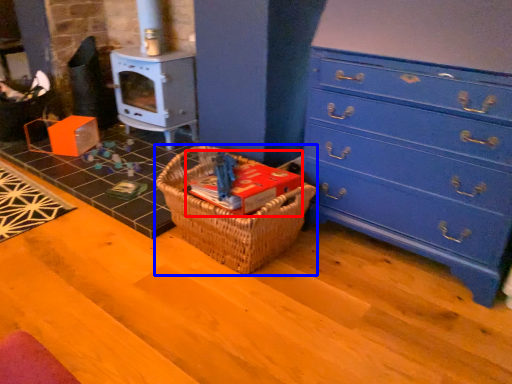
Question: Which point is closer to the camera, book (highlighted by a red box) or picnic basket (highlighted by a blue box)?

Choices:
 (A) book
 (B) picnic basket

Answer: (B)